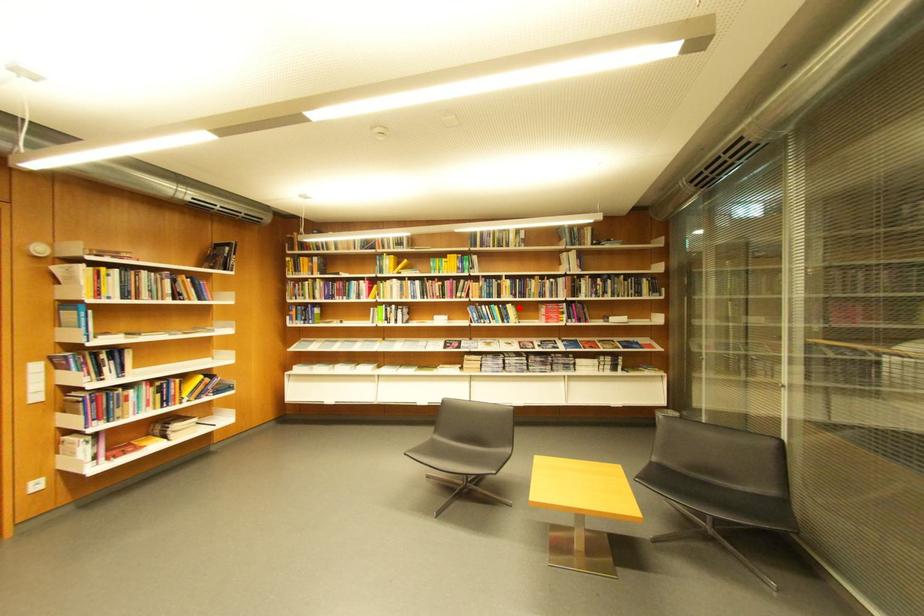
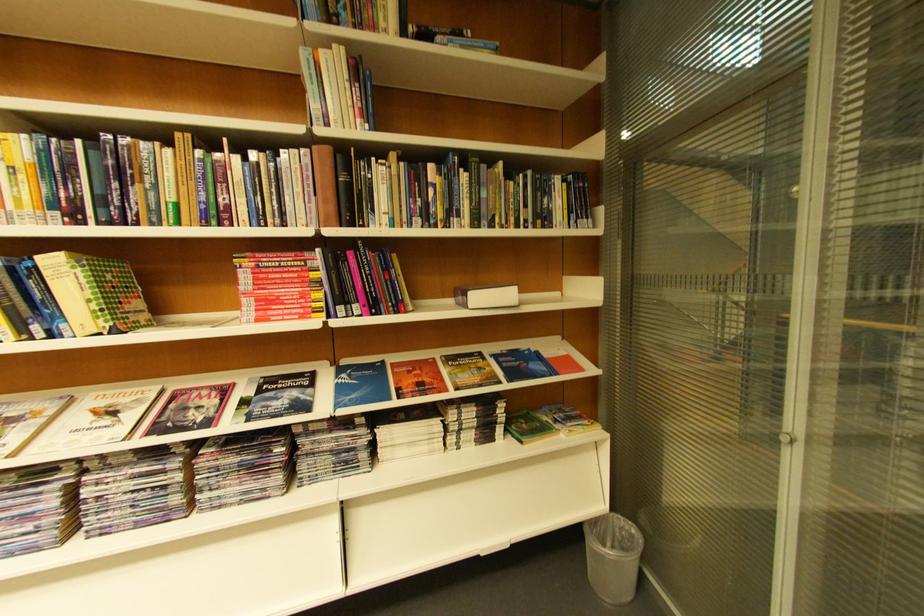
Find the pixel in the second image that matches the highlighted location in the first image.

(63, 264)